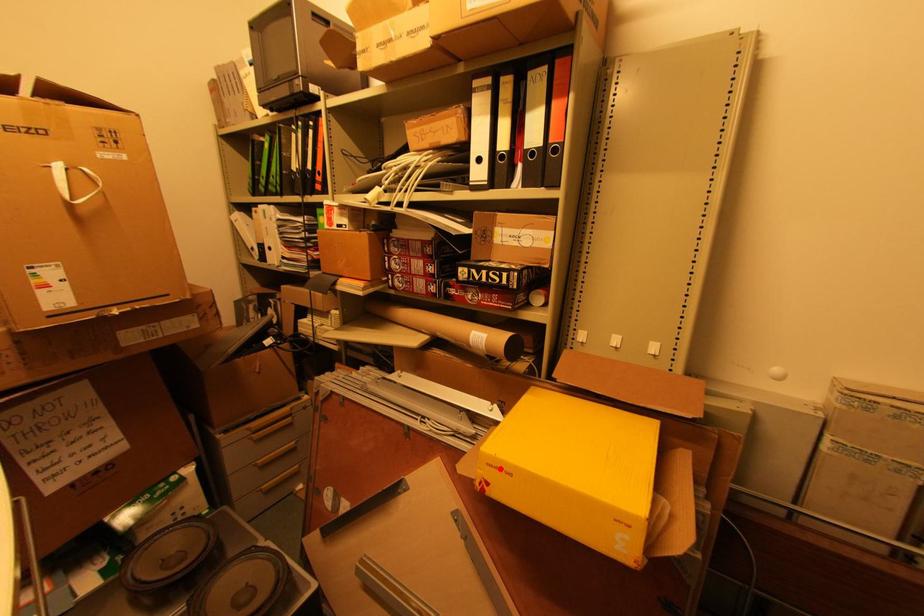
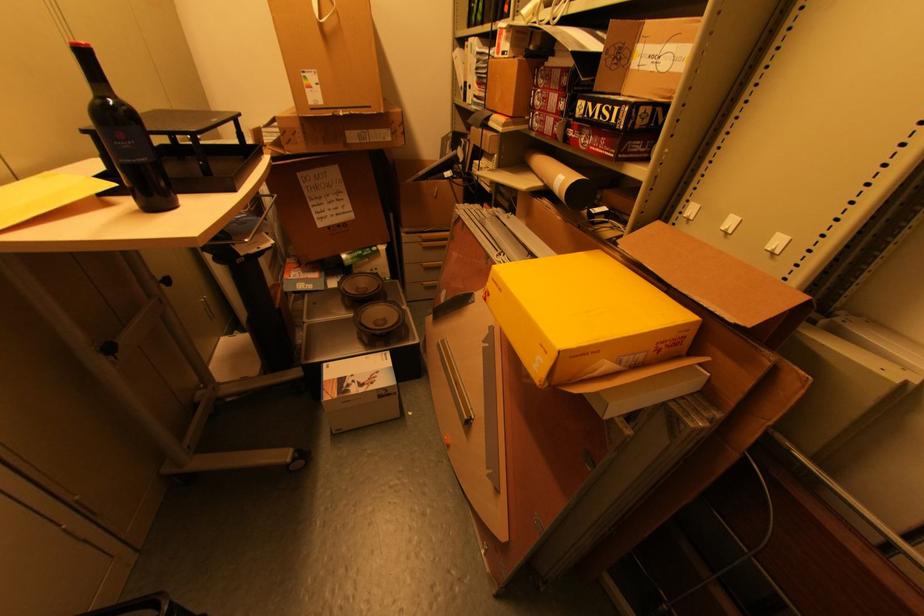
Question: I am providing you with two images of the same scene from different viewpoints. A red point is marked on the first image. At the location where the point appears in image 1, is it still visible in image 2?

Choices:
 (A) Yes
 (B) No

Answer: (A)